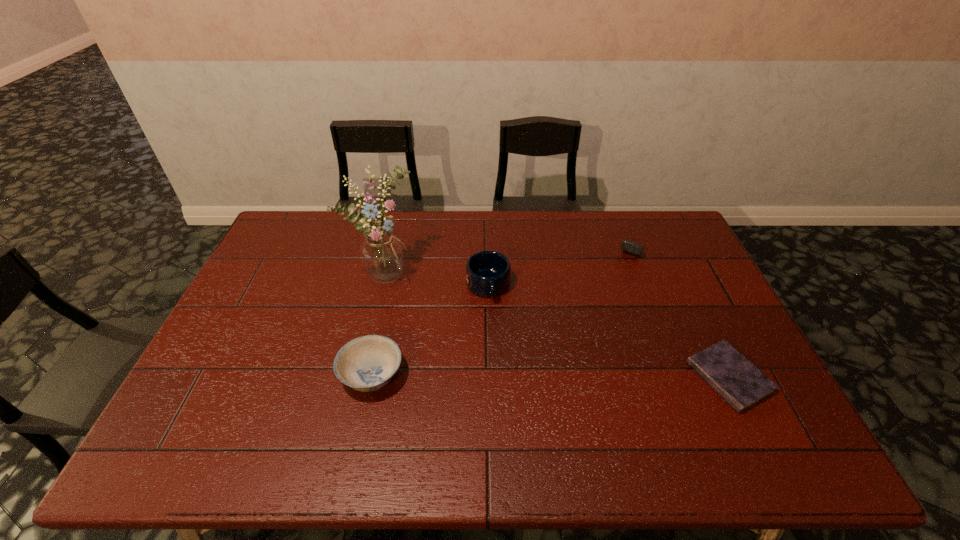
What are the coordinates of `the third shortest object` in the screenshot? It's located at (368, 363).

Identify the location of the shortest object. [x=741, y=384].

This screenshot has height=540, width=960. In order to click on the fourth tallest object in this screenshot , I will do `click(634, 248)`.

At what (x,y) coordinates should I click in order to perform the action: click on mug. Please return your answer as a coordinate pair (x, y). The width and height of the screenshot is (960, 540). Looking at the image, I should click on (488, 273).

Find the location of `the fourth shortest object`. the fourth shortest object is located at coordinates (488, 273).

You are a GUI agent. You are given a task and a screenshot of the screen. Output one action in this format:
    pyautogui.click(x=<x>, y=<y>)
    Task: Click on the bouquet
    Image resolution: width=960 pixels, height=540 pixels.
    Given the screenshot: What is the action you would take?
    pyautogui.click(x=382, y=254)

You are a GUI agent. You are given a task and a screenshot of the screen. Output one action in this format:
    pyautogui.click(x=<x>, y=<y>)
    Task: Click on the vacant region located on the left of the bowl
    
    Given the screenshot: What is the action you would take?
    pyautogui.click(x=206, y=375)

The height and width of the screenshot is (540, 960). In order to click on vacant space located on the back of the diary in this screenshot , I will do `click(669, 255)`.

The width and height of the screenshot is (960, 540). What are the coordinates of `blank area located on the front-facing side of the webcam` in the screenshot? It's located at (613, 291).

Where is `free space located 0.050m on the front-facing side of the webcam`? free space located 0.050m on the front-facing side of the webcam is located at coordinates coord(627,265).